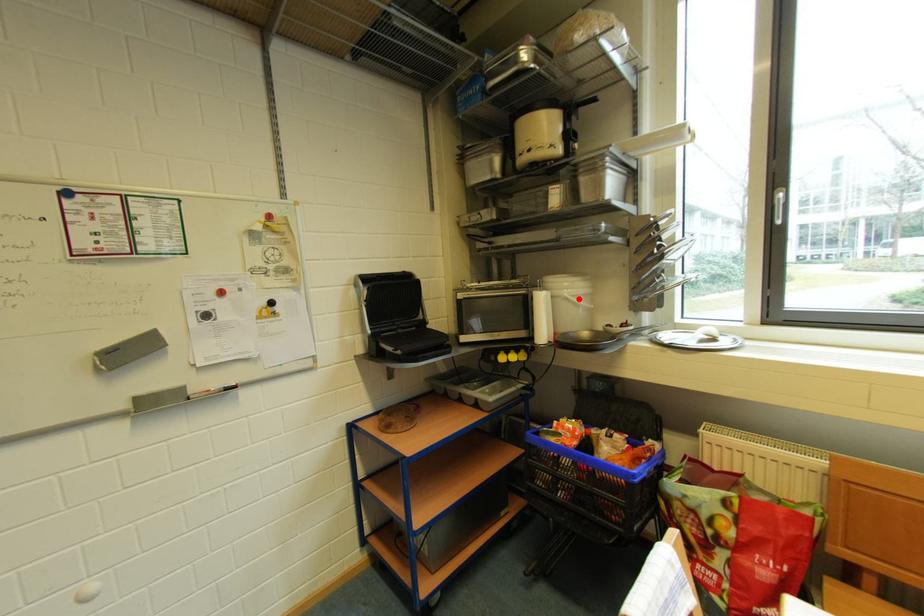
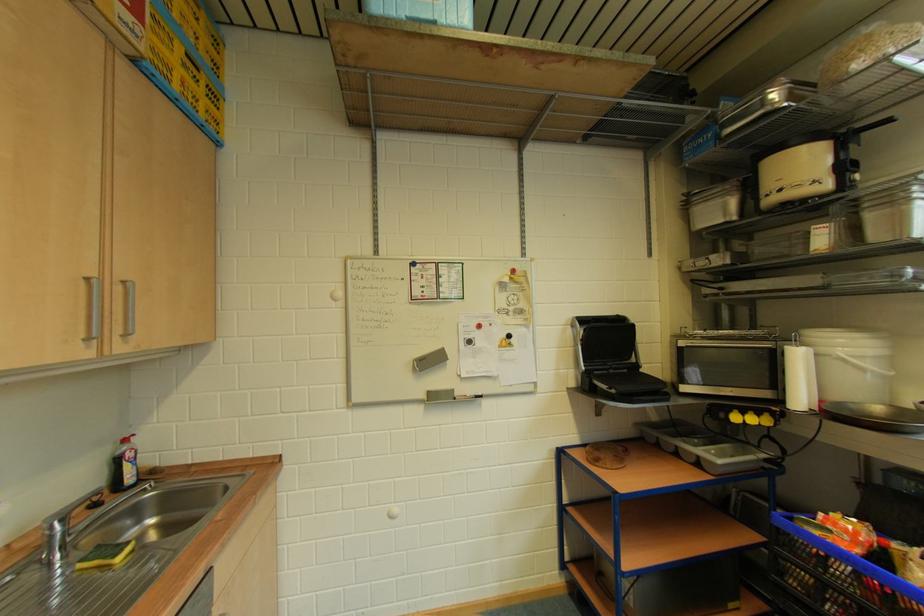
In the second image, find the point that corresponds to the highlighted location in the first image.

(858, 360)